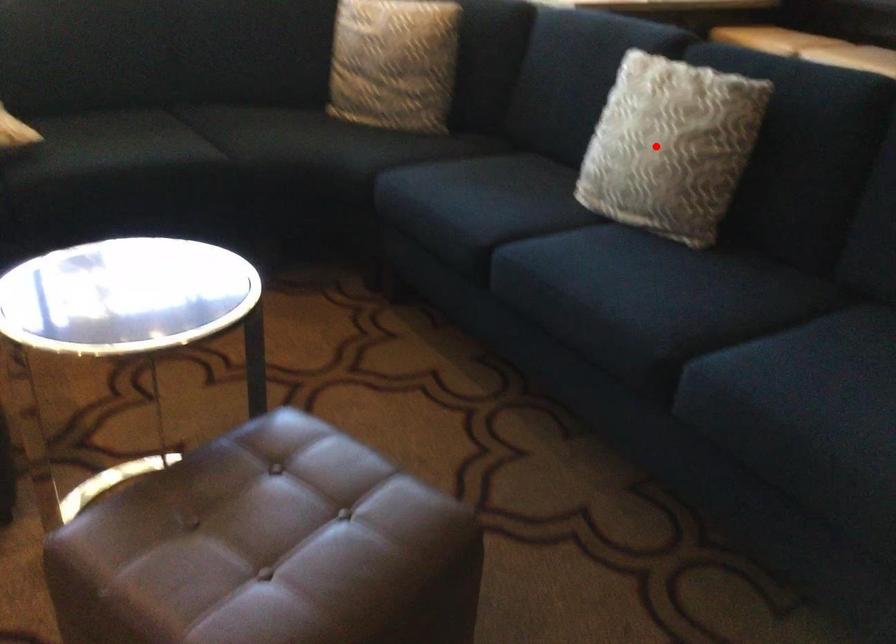
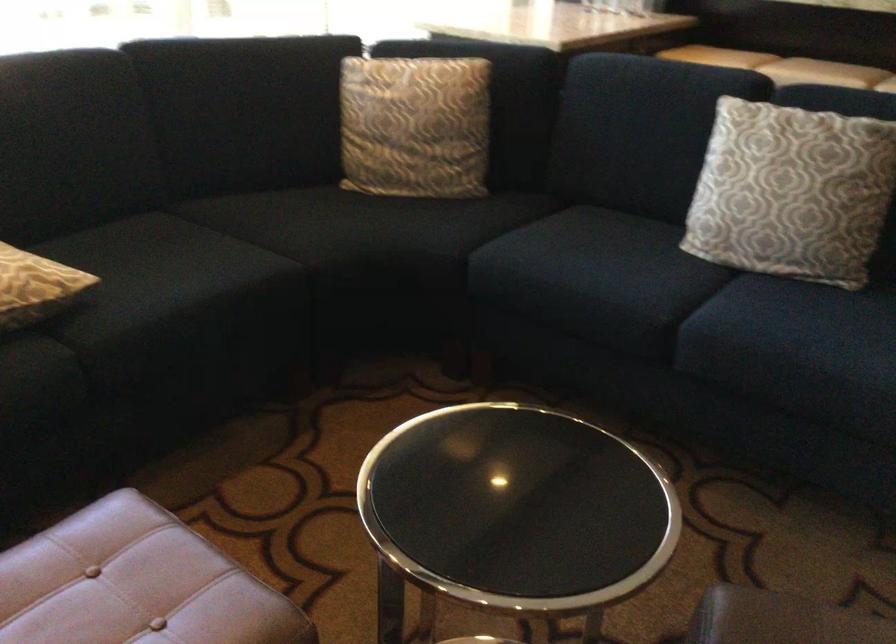
Where in the second image is the point corresponding to the highlighted location from the first image?

(791, 192)